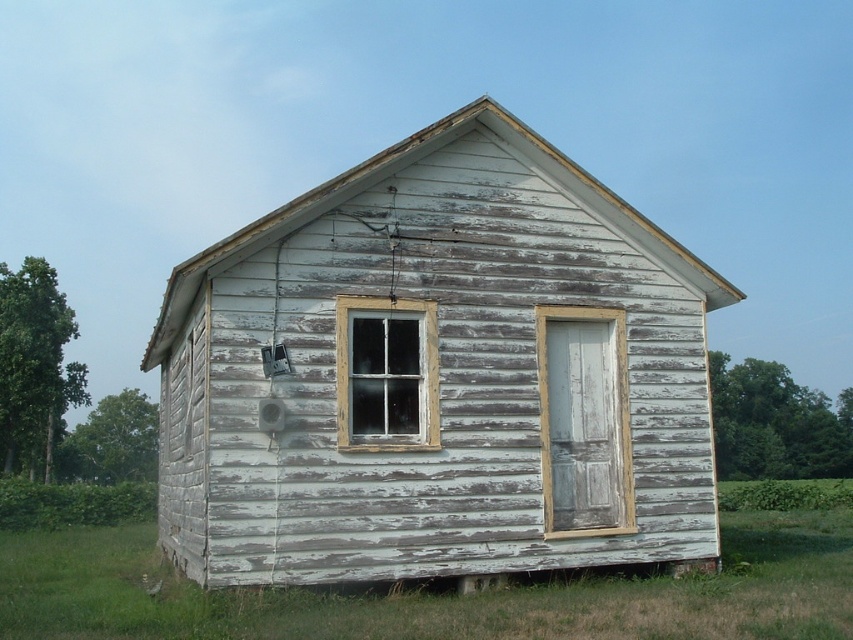
Which is above, white weathered wood hut at center or white weathered wood at lower right?

white weathered wood hut at center is above.

Is white weathered wood hut at center bigger than white weathered wood at lower right?

Incorrect, white weathered wood hut at center is not larger than white weathered wood at lower right.

Between point (322, 480) and point (793, 516), which one is positioned in front?

Positioned in front is point (322, 480).

Locate an element on the screen. The image size is (853, 640). white weathered wood hut at center is located at coordinates (437, 376).

Is weathered wood window at center in front of clear glass window at center?

No.

Describe the element at coordinates (583, 420) in the screenshot. Image resolution: width=853 pixels, height=640 pixels. I see `weathered wood window at center` at that location.

This screenshot has width=853, height=640. Find the location of `weathered wood window at center`. weathered wood window at center is located at coordinates (583, 420).

Between white weathered wood hut at center and clear glass window at center, which one is positioned lower?

white weathered wood hut at center is below.

Is the position of white weathered wood hut at center more distant than that of clear glass window at center?

No.

You are a GUI agent. You are given a task and a screenshot of the screen. Output one action in this format:
    pyautogui.click(x=<x>, y=<y>)
    Task: Click on the white weathered wood hut at center
    This screenshot has height=640, width=853.
    Given the screenshot: What is the action you would take?
    pyautogui.click(x=437, y=376)